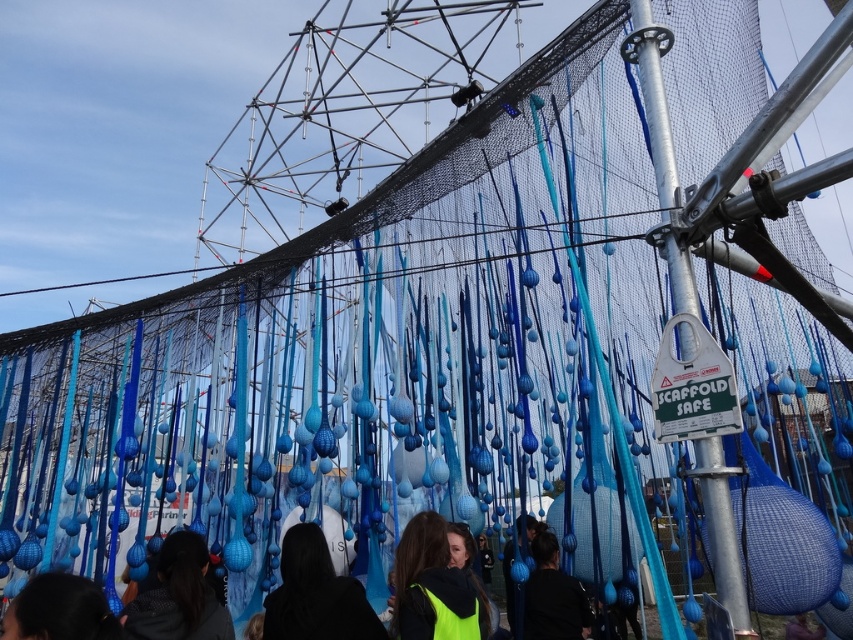
Can you confirm if dark brown hair at center is thinner than neon yellow jacket at center?

No, dark brown hair at center is not thinner than neon yellow jacket at center.

Which is more to the right, dark brown hair at center or neon yellow jacket at center?

neon yellow jacket at center

Is point (294, 532) farther from camera compared to point (471, 632)?

Yes, it is behind point (471, 632).

What are the coordinates of `dark brown hair at center` in the screenshot? It's located at tap(316, 595).

Is silver metallic pole at center positioned behind dark brown hair at lower left?

Yes.

This screenshot has height=640, width=853. Describe the element at coordinates (722, 532) in the screenshot. I see `silver metallic pole at center` at that location.

This screenshot has height=640, width=853. In order to click on silver metallic pole at center in this screenshot , I will do `click(722, 532)`.

Does silver metallic pole at center appear on the left side of matte black hair at lower left?

No, silver metallic pole at center is not to the left of matte black hair at lower left.

Is silver metallic pole at center in front of matte black hair at lower left?

No.

Is point (712, 531) behind point (194, 627)?

No.

Where is `silver metallic pole at center`? Image resolution: width=853 pixels, height=640 pixels. silver metallic pole at center is located at coordinates (722, 532).